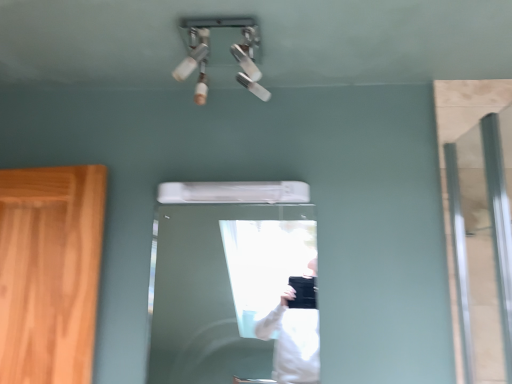
What do you see at coordinates (220, 286) in the screenshot? This screenshot has height=384, width=512. I see `white glossy door at center` at bounding box center [220, 286].

Locate an element on the screen. white glossy door at center is located at coordinates (220, 286).

What is the approximate height of white glossy door at center?

white glossy door at center is 21.14 inches in height.

Describe the element at coordinates (483, 244) in the screenshot. I see `clear glass door at right` at that location.

In order to face clear glass door at right, should I rotate leftwards or rightwards?

A 27.884 degree turn to the right will do.

Find the location of a particular element. This screenshot has width=512, height=384. clear glass door at right is located at coordinates (483, 244).

Find the location of a particular element. white glossy door at center is located at coordinates (220, 286).

Which is more to the right, clear glass door at right or white glossy door at center?

From the viewer's perspective, clear glass door at right appears more on the right side.

Who is more distant, clear glass door at right or white glossy door at center?

white glossy door at center is more distant.

Does point (464, 211) come closer to viewer compared to point (165, 239)?

Yes, it is.

From the image's perspective, which one is positioned lower, clear glass door at right or white glossy door at center?

white glossy door at center is shown below in the image.

From a real-world perspective, which object rests below the other?

From a 3D spatial view, white glossy door at center is below.

Which of these two, clear glass door at right or white glossy door at center, is thinner?

With smaller width is white glossy door at center.

Considering the sizes of objects clear glass door at right and white glossy door at center in the image provided, who is shorter, clear glass door at right or white glossy door at center?

With less height is white glossy door at center.

Based on the photo, does clear glass door at right have a larger size compared to white glossy door at center?

Correct, clear glass door at right is larger in size than white glossy door at center.

Which is correct: clear glass door at right is inside white glossy door at center, or outside of it?

clear glass door at right is spatially situated outside white glossy door at center.

Is clear glass door at right not close to white glossy door at center?

Yes.

Is clear glass door at right oriented towards white glossy door at center?

Yes, clear glass door at right is turned towards white glossy door at center.

You are a GUI agent. You are given a task and a screenshot of the screen. Output one action in this format:
    pyautogui.click(x=<x>, y=<y>)
    Task: Click on the screen door that is above the white glossy door at center (from a real-world perspective)
    The height and width of the screenshot is (384, 512).
    Given the screenshot: What is the action you would take?
    pyautogui.click(x=483, y=244)

Does white glossy door at center appear on the left side of clear glass door at right?

Yes.

Does white glossy door at center come in front of clear glass door at right?

That is False.

Which is farther from the camera, (214, 233) or (460, 304)?

The point (214, 233) is farther.

From the image's perspective, is white glossy door at center beneath clear glass door at right?

Correct, white glossy door at center appears lower than clear glass door at right in the image.

From a real-world perspective, who is located lower, white glossy door at center or clear glass door at right?

white glossy door at center, from a real-world perspective.

Looking at their sizes, would you say white glossy door at center is wider or thinner than clear glass door at right?

white glossy door at center is thinner than clear glass door at right.

Considering the sizes of white glossy door at center and clear glass door at right in the image, is white glossy door at center taller or shorter than clear glass door at right?

Considering their sizes, white glossy door at center has less height than clear glass door at right.

Considering the relative sizes of white glossy door at center and clear glass door at right in the image provided, is white glossy door at center bigger than clear glass door at right?

Actually, white glossy door at center might be smaller than clear glass door at right.

Is white glossy door at center positioned beyond the bounds of clear glass door at right?

white glossy door at center lies outside clear glass door at right's area.

Is there a large distance between white glossy door at center and clear glass door at right?

Yes, white glossy door at center and clear glass door at right are quite far apart.

Is white glossy door at center oriented towards clear glass door at right?

No, white glossy door at center is not turned towards clear glass door at right.

The width and height of the screenshot is (512, 384). Identify the location of door that is below the clear glass door at right (from the image's perspective). (220, 286).

Locate an element on the screen. door located behind the clear glass door at right is located at coordinates (220, 286).

Identify the location of screen door lying above the white glossy door at center (from the image's perspective). The image size is (512, 384). (483, 244).